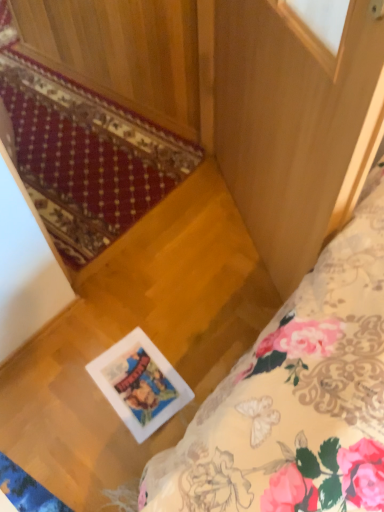
The height and width of the screenshot is (512, 384). Identify the location of free space above white glossy picture frame at center (from a real-world perspective). coord(143,377).